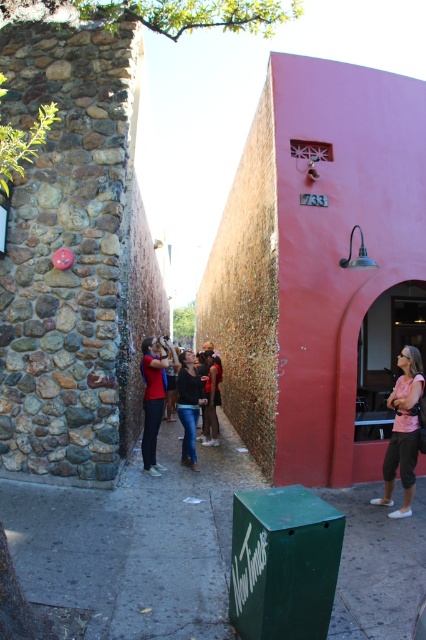
You are a delivery person carrying a box that is 2 meters long. You need to place it horizontally on the green painted concrete pavement at center and pink fabric at center. Can you fit the box between them without overlapping either surface?

The green painted concrete pavement at center and pink fabric at center are 2.23 meters apart. Since the box is 2 meters long, it can fit between them without overlapping either surface because the distance between the two surfaces is greater than the box length.

You are standing in the alleyway and notice two items at the center of the scene. The first is the green painted concrete pavement at center, and the second is the pink fabric at center. From your perspective, which one is located to the left?

The green painted concrete pavement at center is positioned on the left side of pink fabric at center, so from your perspective, the green painted concrete pavement at center is located to the left.

You are standing in the alleyway and see the pink fabric at center and the denim jeans at center. Which object is nearer to you?

The pink fabric at center is closer to the viewer than the denim jeans at center.